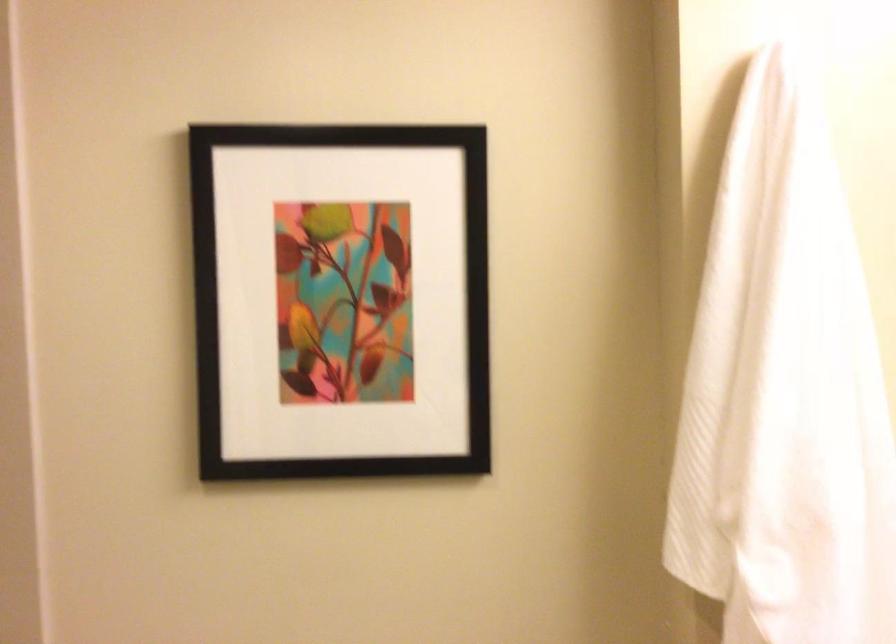
Identify the location of black picture frame. The height and width of the screenshot is (644, 896). (340, 299).